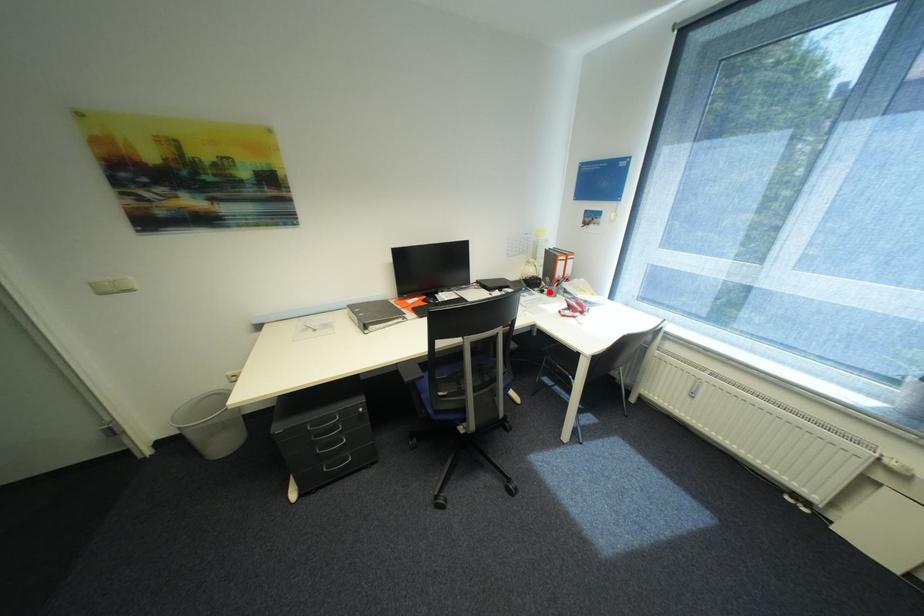
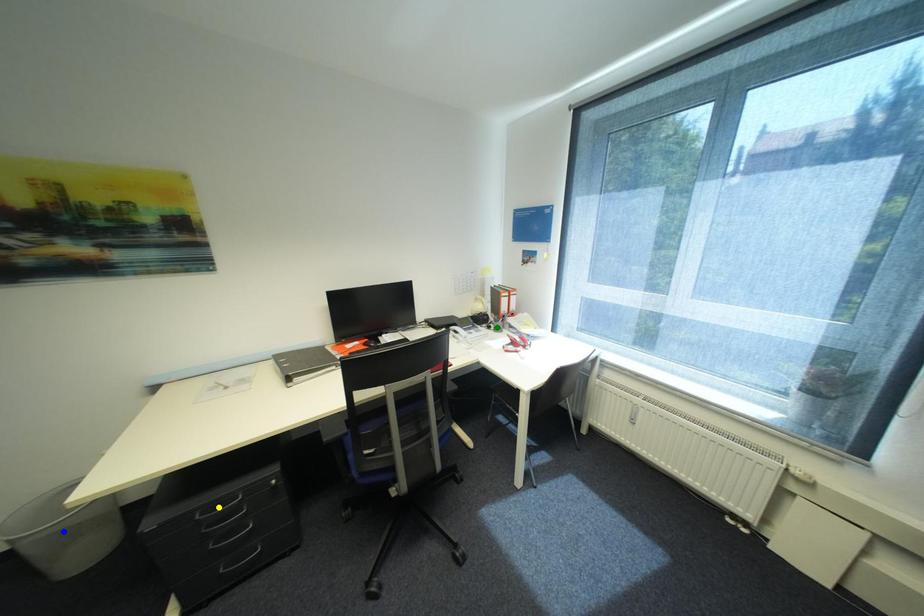
Question: I am providing you with two images of the same scene from different viewpoints. A red point is marked on the first image. You are given multiple points on the second image. Which point in image 2 represents the same 3d spot as the red point in image 1?

Choices:
 (A) blue point
 (B) yellow point
 (C) green point

Answer: (C)